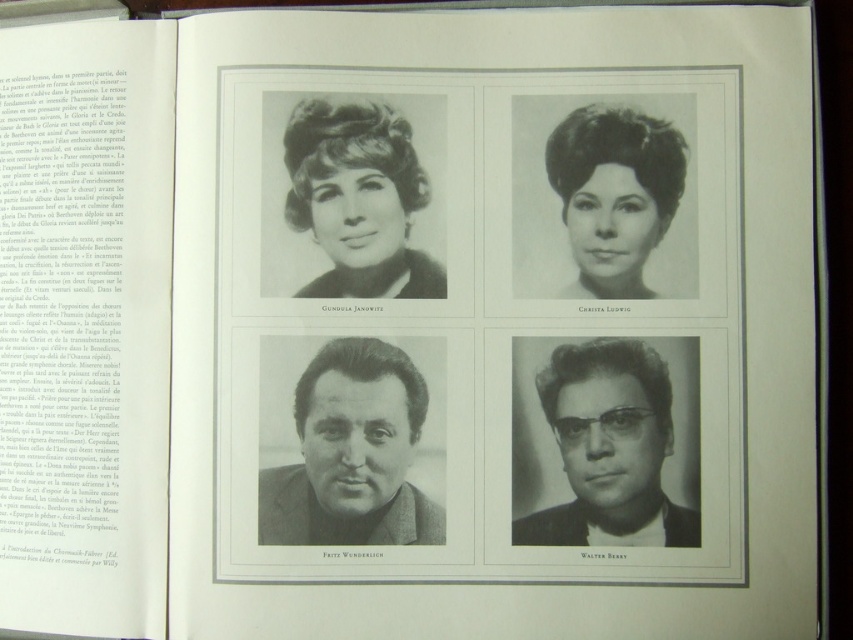
Is matte black jacket at center shorter than smooth black hair at upper right?

No, matte black jacket at center is not shorter than smooth black hair at upper right.

Who is shorter, matte black jacket at center or smooth black hair at upper right?

smooth black hair at upper right is shorter.

What do you see at coordinates (352, 452) in the screenshot?
I see `matte black jacket at center` at bounding box center [352, 452].

Image resolution: width=853 pixels, height=640 pixels. Identify the location of matte black jacket at center. (352, 452).

Which is in front, point (372, 124) or point (660, 196)?

Point (660, 196) is more forward.

Is matte black hair at upper left to the right of smooth black hair at upper right from the viewer's perspective?

In fact, matte black hair at upper left is to the left of smooth black hair at upper right.

Describe the element at coordinates (358, 198) in the screenshot. The width and height of the screenshot is (853, 640). I see `matte black hair at upper left` at that location.

Image resolution: width=853 pixels, height=640 pixels. What are the coordinates of `matte black hair at upper left` in the screenshot? It's located at (358, 198).

Between matte black glasses at bottom right and smooth black hair at upper right, which one is positioned lower?

matte black glasses at bottom right

Measure the distance between matte black glasses at bottom right and camera.

57.40 centimeters

You are a GUI agent. You are given a task and a screenshot of the screen. Output one action in this format:
    pyautogui.click(x=<x>, y=<y>)
    Task: Click on the matte black glasses at bottom right
    
    Given the screenshot: What is the action you would take?
    pyautogui.click(x=608, y=449)